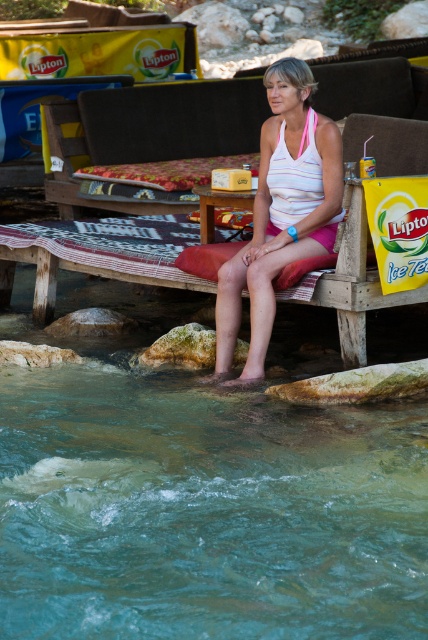
You are a hiker who wants to sit down and cool your feet in the clear water at feet lower. The wooden park bench at center is nearby. Which object is on the left side of the bench?

The clear water at feet lower is positioned on the left side of the wooden park bench at center.

In the scene shown: You are a photographer trying to capture the woman sitting on the wooden bench in the serene outdoor setting. To ensure the white striped tank top at center and the wooden picnic table at center are both visible in your photo, where should you position the camera relative to the woman?

The white striped tank top at center is below the wooden picnic table at center, so positioning the camera above the woman would allow both the tank top and the picnic table to be visible in the photo.